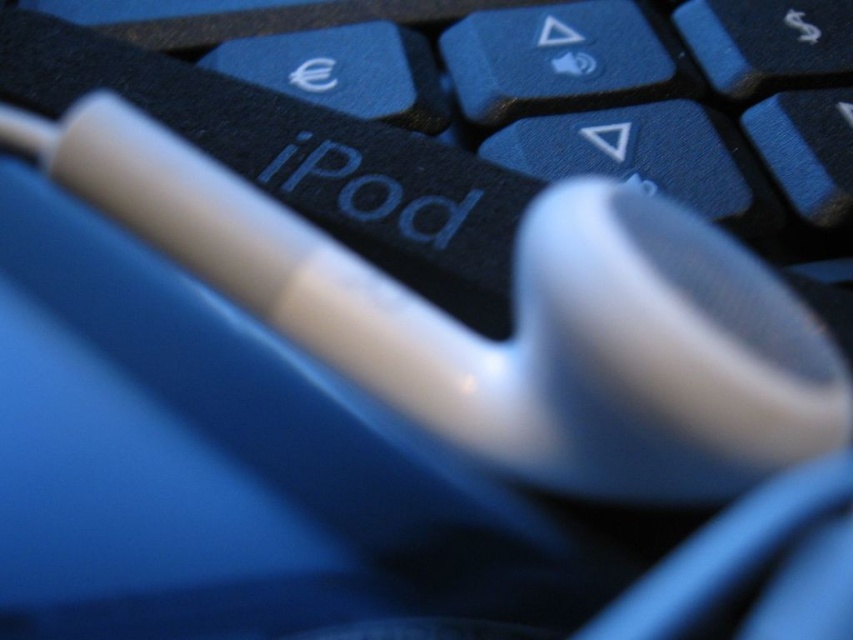
You need to place a white plastic mouse at center on top of a black matte keyboard at center. Will the mouse fit entirely on the keyboard without hanging over the edges?

The white plastic mouse at center has a lesser width compared to black matte keyboard at center, so it will fit entirely on the keyboard without hanging over the edges.

You are trying to locate two points on the keyboard. The first point is at coordinates point (703, 237) and the second is at point (419, 275). From your perspective, which point is closer to you?

Point (703, 237) is in front of point (419, 275), so it is closer to you.

Based on the photo, you need to place a new object between the white plastic mouse at center and the black matte keyboard at center. Which object would you choose if you want the new object to be larger than the mouse but smaller than the keyboard?

The new object should be larger than the white plastic mouse at center but smaller than the black matte keyboard at center. Since the white plastic mouse at center is smaller than the black matte keyboard at center, any object with a size between them would work, such as a smartphone or a small notebook.